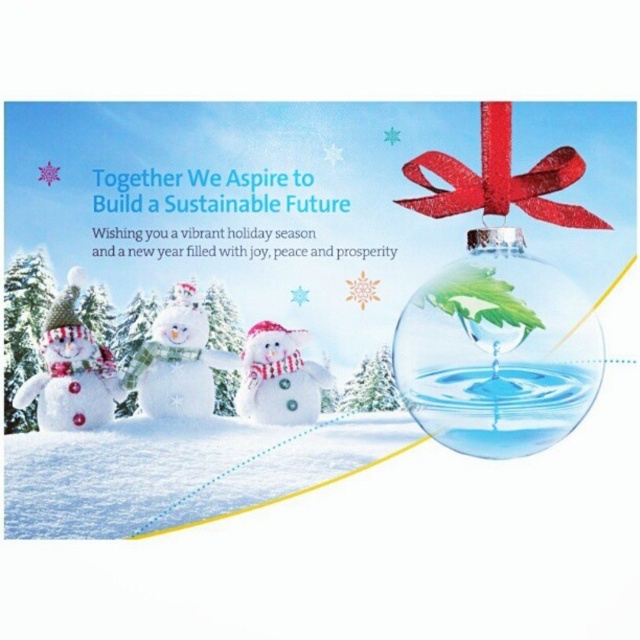
You are an artist drawing the scene and want to place a new element exactly at the point marked by the coordinates point (307, 289). What object is already located there?

The point (307, 289) corresponds to the transparent glass ornament at right, so placing a new element there would overlap with the transparent glass ornament at right.

You are a photographer taking a picture of the white fluffy snowman at center and the white matte snowman at center. Which one should you focus on if you want to capture the one closer to the camera?

The white fluffy snowman at center is closer to the camera, so you should focus on the white fluffy snowman at center.